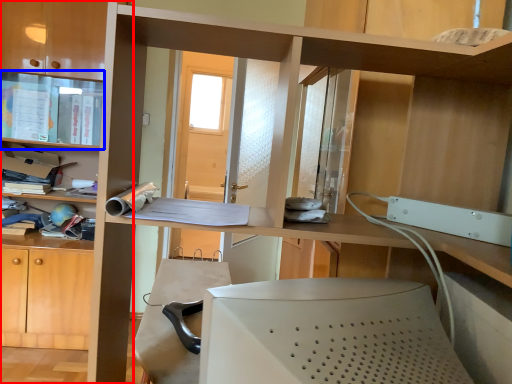
Question: Which of the following is the farthest to the observer, bookcase (highlighted by a red box) or cabinet (highlighted by a blue box)?

Choices:
 (A) bookcase
 (B) cabinet

Answer: (B)